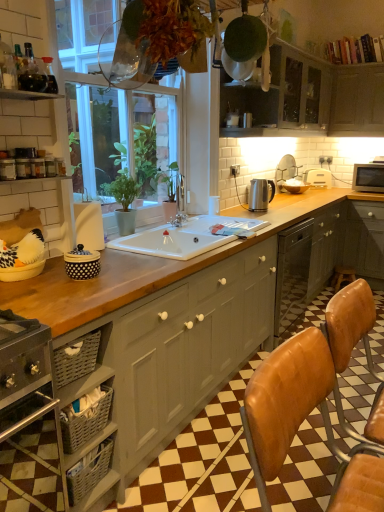
Where is `free location above white plastic toaster at upper right, the first appliance from the back (from a real-world perspective)`? free location above white plastic toaster at upper right, the first appliance from the back (from a real-world perspective) is located at coordinates (326, 165).